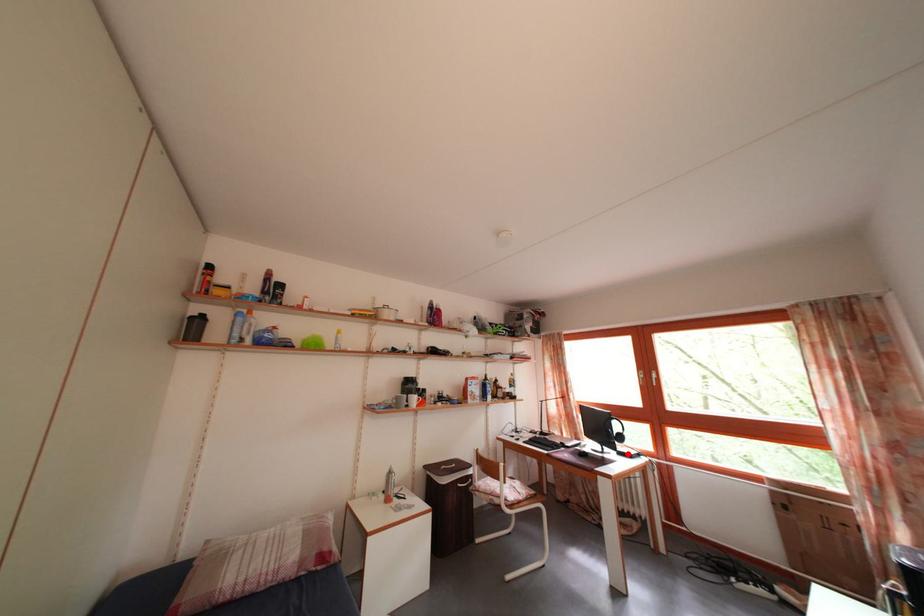
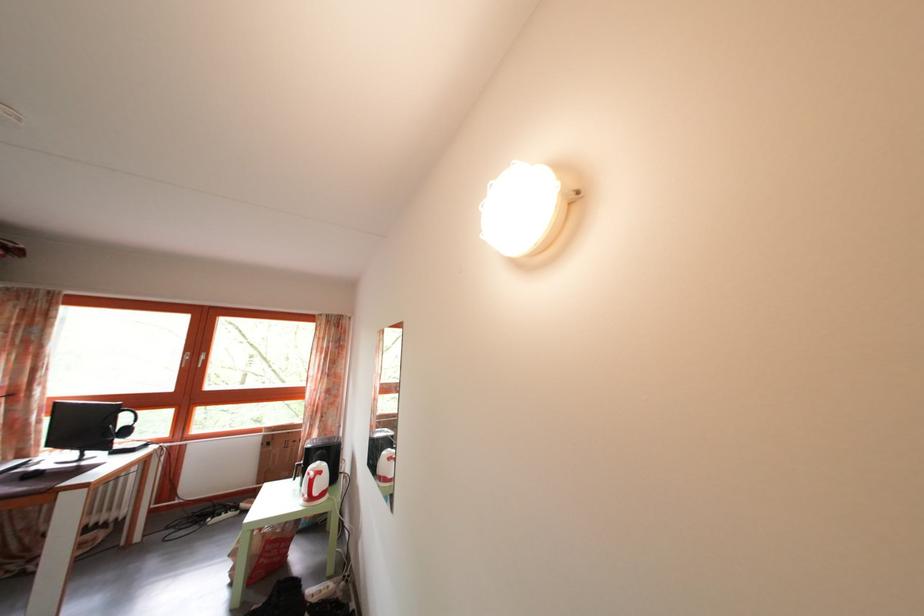
Question: I am providing you with two images of the same scene from different viewpoints. In image1, a red point is highlighted. Considering the same 3D point in image2, which of the following is correct?

Choices:
 (A) It is closer
 (B) It is farther

Answer: (A)